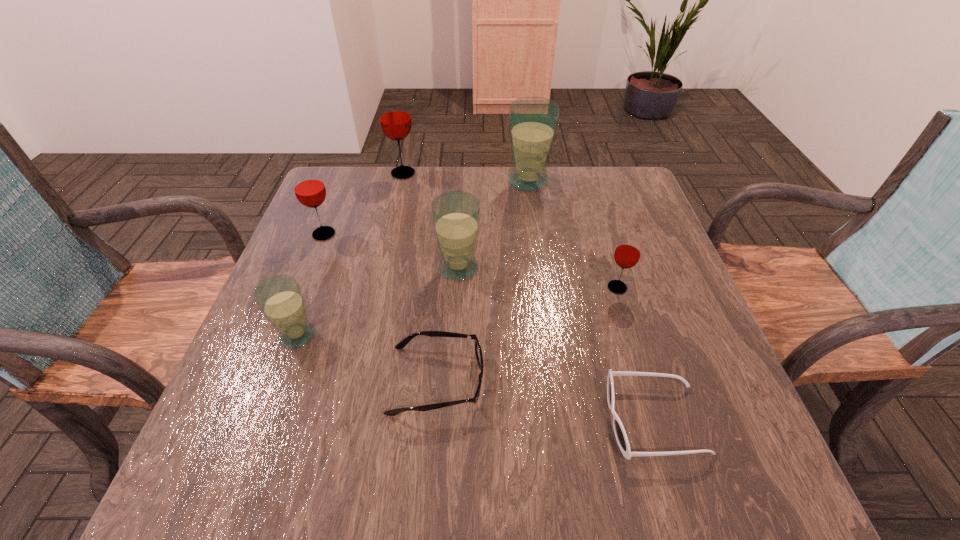
This screenshot has height=540, width=960. I want to click on blank space at the left edge, so click(x=347, y=234).

You are a GUI agent. You are given a task and a screenshot of the screen. Output one action in this format:
    pyautogui.click(x=<x>, y=<y>)
    Task: Click on the vacant space at the right edge of the desktop
    The height and width of the screenshot is (540, 960).
    Given the screenshot: What is the action you would take?
    pyautogui.click(x=632, y=308)

This screenshot has width=960, height=540. I want to click on free point at the far left corner, so click(x=377, y=169).

The height and width of the screenshot is (540, 960). In order to click on vacant space at the far right corner of the desktop in this screenshot , I will do `click(595, 177)`.

At what (x,y) coordinates should I click in order to perform the action: click on free space between the nearest blue glass and the fourth glass from right to left. Please return your answer as a coordinate pair (x, y). This screenshot has width=960, height=540. Looking at the image, I should click on (350, 254).

At what (x,y) coordinates should I click in order to perform the action: click on vacant space that's between the sunglasses and the fifth glass from left to right. Please return your answer as a coordinate pair (x, y). Image resolution: width=960 pixels, height=540 pixels. Looking at the image, I should click on (591, 301).

This screenshot has width=960, height=540. In order to click on vacant area that lies between the rightmost glass and the sunglasses in this screenshot , I will do `click(636, 354)`.

The width and height of the screenshot is (960, 540). What are the coordinates of `free space between the nearest blue glass and the nearest red glass` in the screenshot? It's located at (457, 312).

The width and height of the screenshot is (960, 540). What are the coordinates of `vacant point located between the rightmost glass and the spectacles` in the screenshot? It's located at (527, 334).

Identify the location of vacant point located between the second glass from right to left and the smallest red glass. (573, 234).